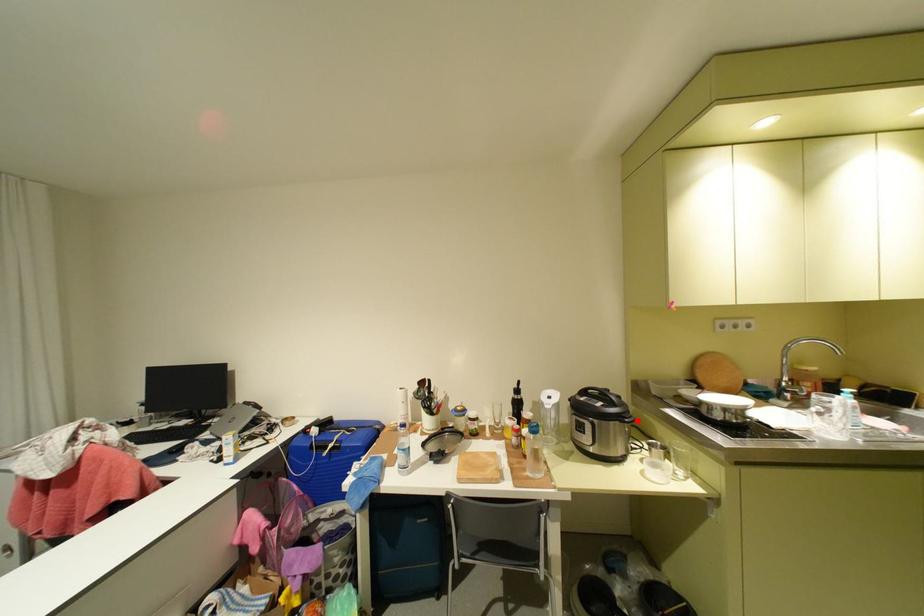
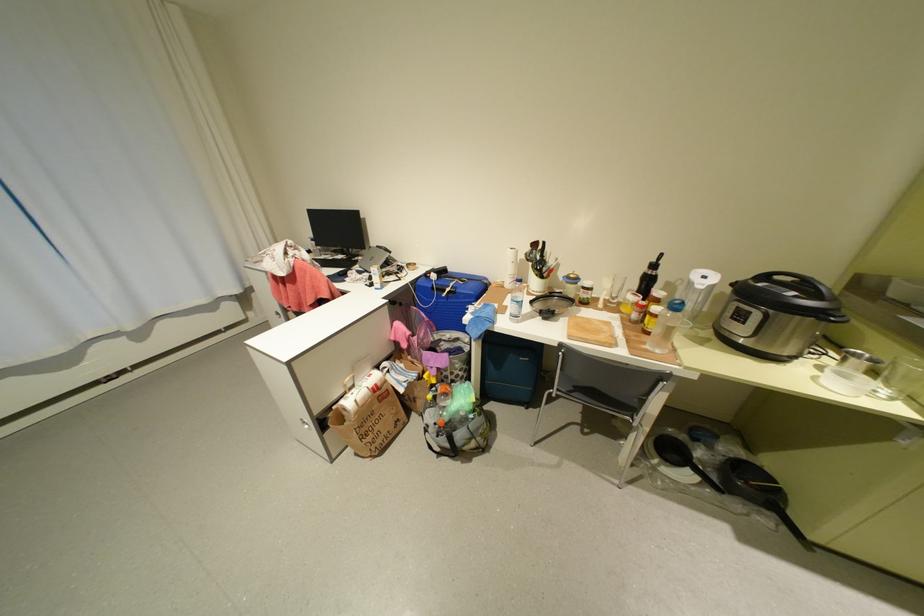
Find the pixel in the second image that matches the highlighted location in the first image.

(844, 320)